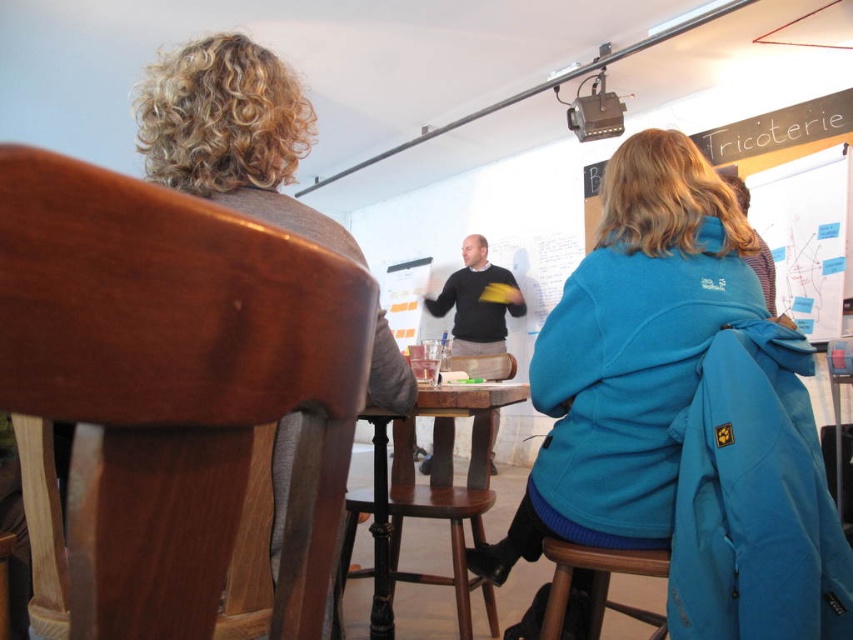
From the picture: You are attending a workshop and need to sit next to the person wearing the black matte sweater at center. Which direction should you move from the brown leather chair at left to reach them?

The brown leather chair at left is positioned on the left side of the black matte sweater at center, so you should move to the right from the brown leather chair at left to reach the black matte sweater at center.

You are a photographer setting up for an event. You need to position a light source so that it illuminates the black matte sweater at center without casting a shadow on the wooden bar stool at lower right. Based on their positions, where should you place the light source?

The black matte sweater at center is above the wooden bar stool at lower right, so placing the light source directly above the sweater would illuminate it while avoiding casting a shadow on the stool below.

You are a person who is 1.7 meters tall. You want to sit on the brown leather chair at left but need to reach the table that is at the same height as the black matte sweater at center. Can you comfortably reach the table?

The brown leather chair at left is taller than the black matte sweater at center. Since the table is at the same height as the black matte sweater at center, sitting on the taller chair would place you higher, making it difficult to comfortably reach the table.